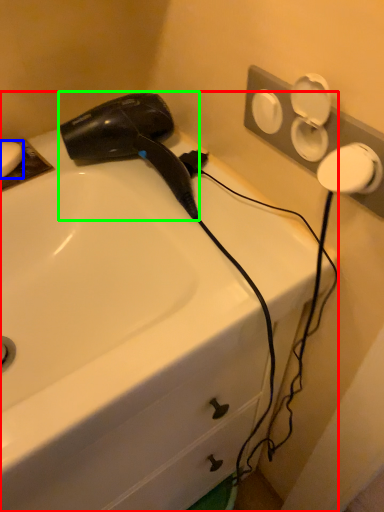
Question: Considering the real-world distances, which object is closest to sink (highlighted by a red box)? soap (highlighted by a blue box) or hair drier (highlighted by a green box).

Choices:
 (A) soap
 (B) hair drier

Answer: (B)